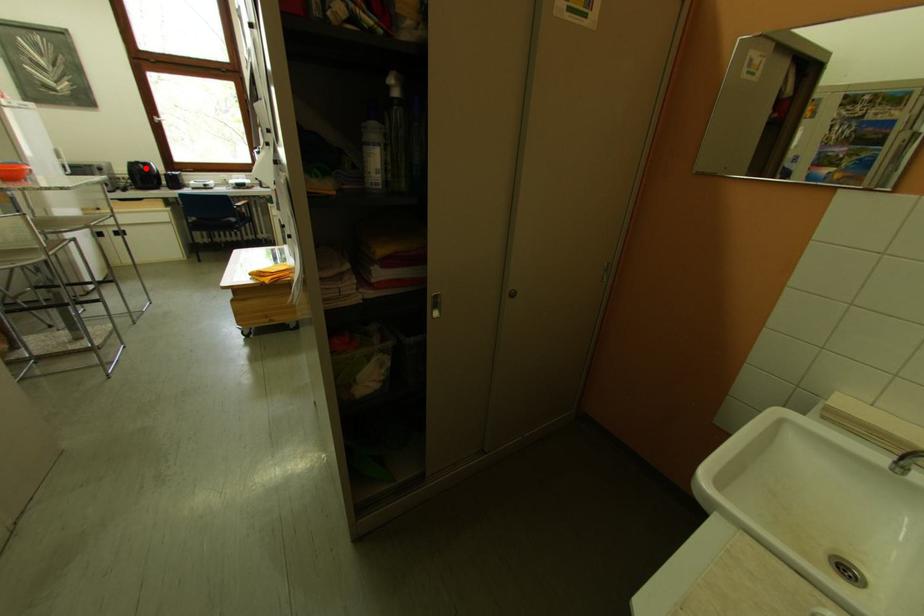
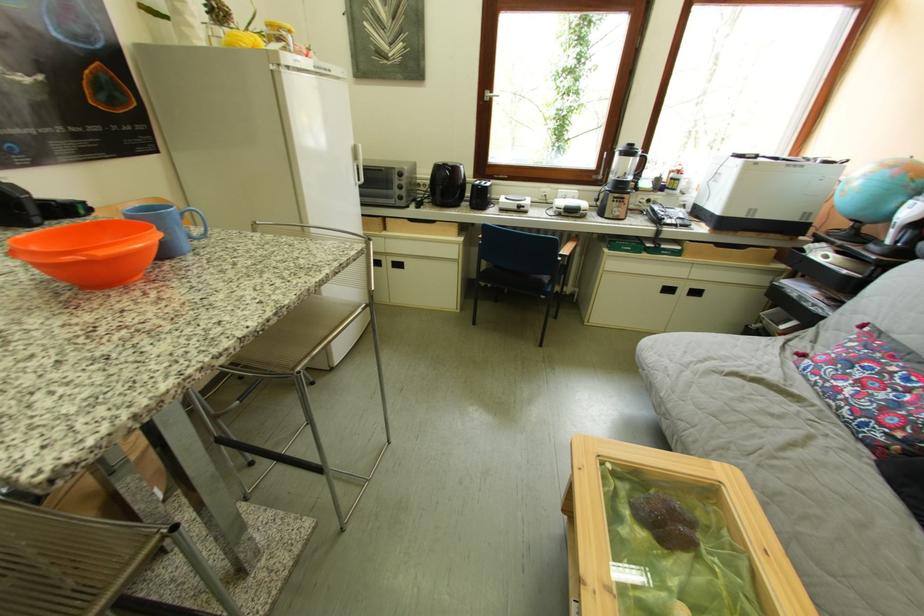
Question: I am providing you with two images of the same scene from different viewpoints. A red point is shown in image1. For the corresponding object point in image2, is it positioned nearer or farther from the camera?

Choices:
 (A) Nearer
 (B) Farther

Answer: (A)